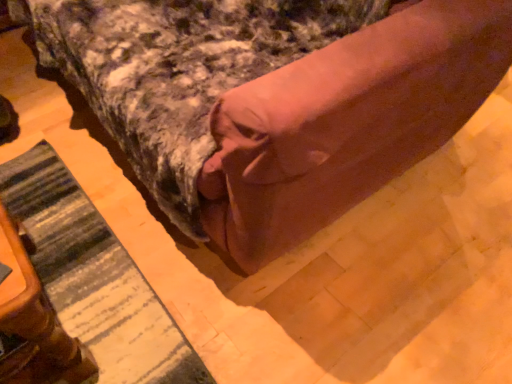
Identify the location of free point to the right of wooden table at lower left. (199, 288).